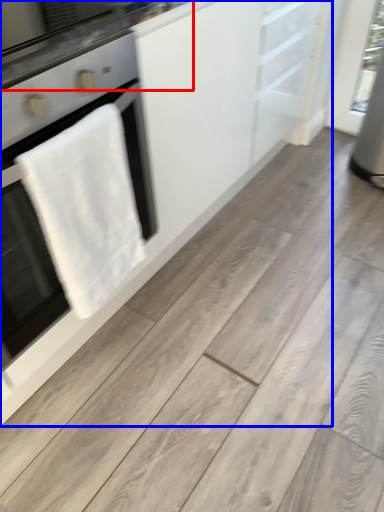
Question: Which object appears closest to the camera in this image, countertop (highlighted by a red box) or cabinetry (highlighted by a blue box)?

Choices:
 (A) countertop
 (B) cabinetry

Answer: (B)